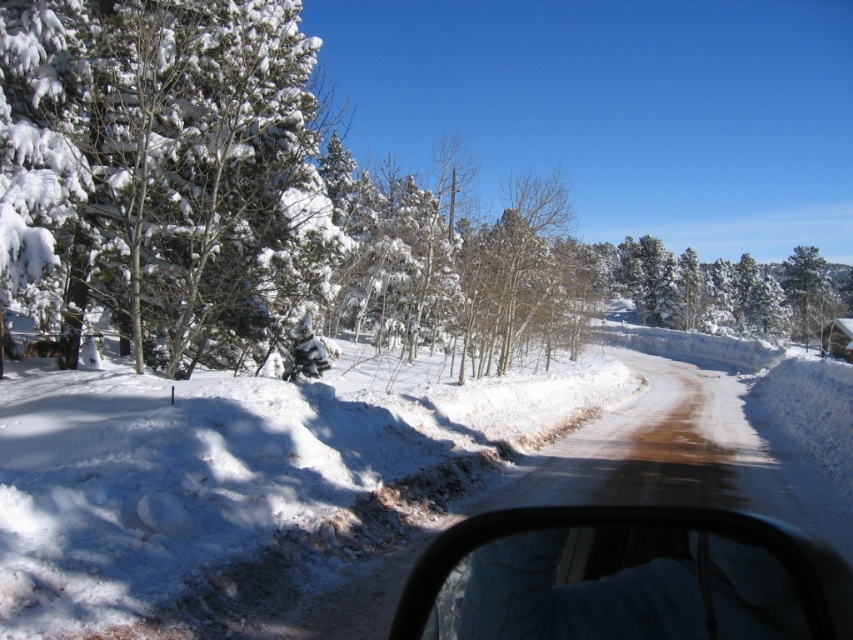
Is snow-covered pine tree at left below transparent plastic window at center?

No, snow-covered pine tree at left is not below transparent plastic window at center.

Can you confirm if snow-covered pine tree at left is thinner than transparent plastic window at center?

Incorrect, snow-covered pine tree at left's width is not less than transparent plastic window at center's.

Identify the location of snow-covered pine tree at left. (161, 172).